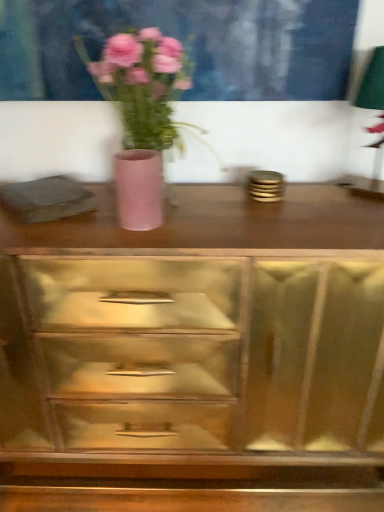
This screenshot has height=512, width=384. I want to click on vacant space situated on the left part of matte pink vase at center, so click(65, 230).